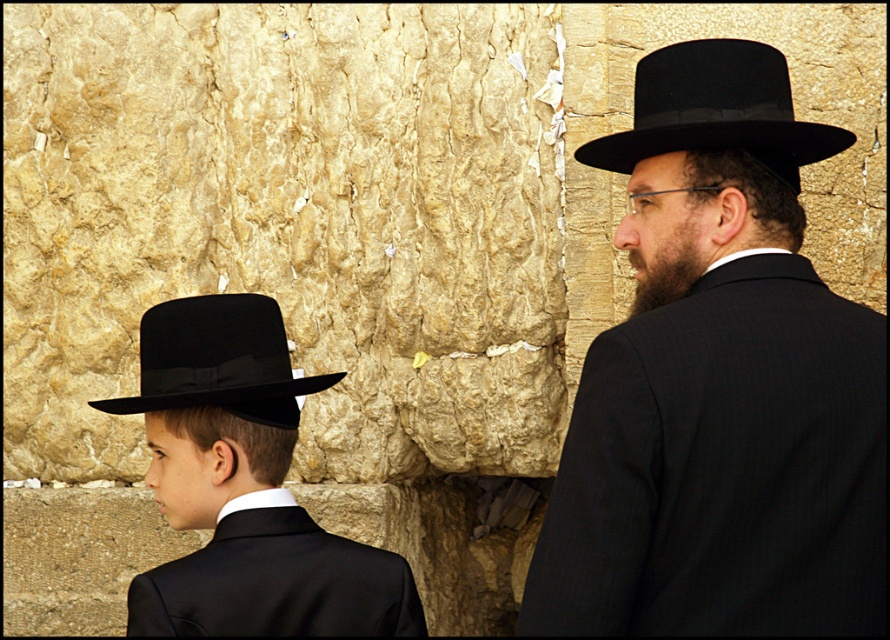
You are a photographer trying to capture both matte black hat at right and matte black hat at left in a single frame. Which hat should you adjust your camera angle to focus on first to ensure both are in the frame?

Since the matte black hat at right is smaller than the matte black hat at left, you should focus on the larger matte black hat at left first to ensure both hats are visible in the frame.